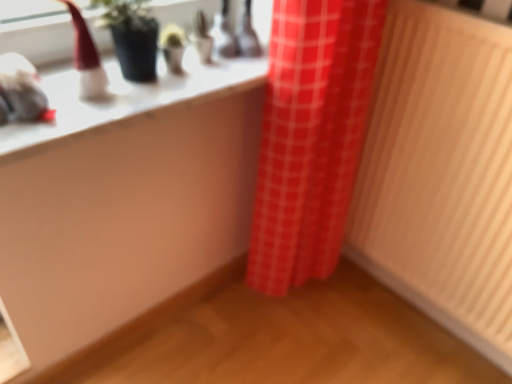
Question: Is wooden radiator at right at the back of red checkered curtain at center?

Choices:
 (A) no
 (B) yes

Answer: (A)

Question: Is the surface of red checkered curtain at center in direct contact with wooden radiator at right?

Choices:
 (A) no
 (B) yes

Answer: (A)

Question: From the image's perspective, would you say red checkered curtain at center is shown under wooden radiator at right?

Choices:
 (A) no
 (B) yes

Answer: (A)

Question: From a real-world perspective, is red checkered curtain at center under wooden radiator at right?

Choices:
 (A) no
 (B) yes

Answer: (A)

Question: From the image's perspective, is red checkered curtain at center on wooden radiator at right?

Choices:
 (A) yes
 (B) no

Answer: (A)

Question: Is red checkered curtain at center thinner than wooden radiator at right?

Choices:
 (A) no
 (B) yes

Answer: (A)

Question: From a real-world perspective, is white glossy counter top at upper left below red checkered curtain at center?

Choices:
 (A) yes
 (B) no

Answer: (B)

Question: From a real-world perspective, does white glossy counter top at upper left stand above red checkered curtain at center?

Choices:
 (A) yes
 (B) no

Answer: (A)

Question: Is white glossy counter top at upper left oriented towards red checkered curtain at center?

Choices:
 (A) no
 (B) yes

Answer: (A)

Question: Is white glossy counter top at upper left outside of red checkered curtain at center?

Choices:
 (A) yes
 (B) no

Answer: (A)

Question: Is white glossy counter top at upper left not near red checkered curtain at center?

Choices:
 (A) no
 (B) yes

Answer: (A)

Question: Is white glossy counter top at upper left further to the viewer compared to red checkered curtain at center?

Choices:
 (A) no
 (B) yes

Answer: (A)

Question: Considering the relative positions of red checkered curtain at center and white glossy counter top at upper left in the image provided, is red checkered curtain at center behind white glossy counter top at upper left?

Choices:
 (A) no
 (B) yes

Answer: (B)